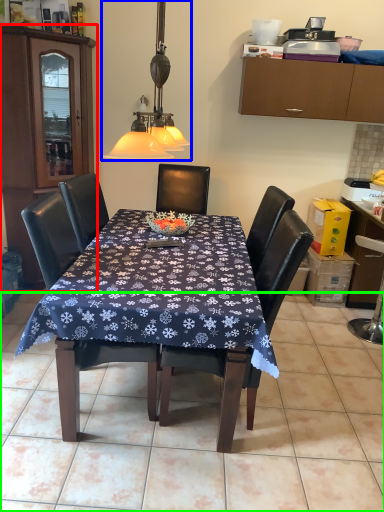
Question: Which object is the farthest from cabinetry (highlighted by a red box)? Choose among these: lamp (highlighted by a blue box) or tile (highlighted by a green box).

Choices:
 (A) lamp
 (B) tile

Answer: (B)